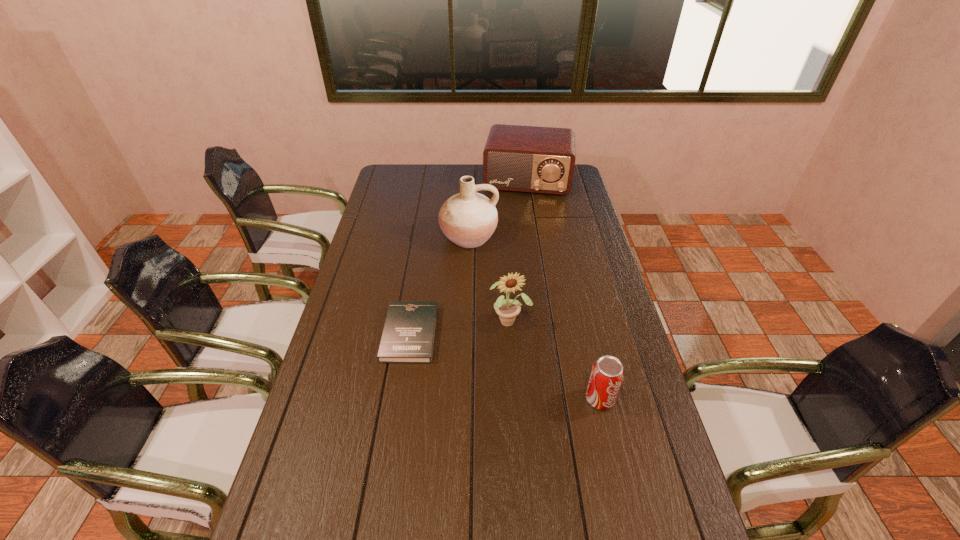
At what (x,y) coordinates should I click in order to perform the action: click on vacant area between the sunflower and the shortest object. Please return your answer as a coordinate pair (x, y). Looking at the image, I should click on (460, 327).

The width and height of the screenshot is (960, 540). What are the coordinates of `free space between the soda can and the radio receiver` in the screenshot? It's located at (564, 290).

Where is `free spot between the farthest object and the shortest object`? free spot between the farthest object and the shortest object is located at coordinates (468, 258).

Identify the location of vacant region between the sunflower and the fourth nearest object. (489, 279).

Select which object appears as the third closest to the second shortest object. Please provide its 2D coordinates. Your answer should be formatted as a tuple, i.e. [(x, y)], where the tuple contains the x and y coordinates of a point satisfying the conditions above.

[(468, 219)]

The height and width of the screenshot is (540, 960). I want to click on the third closest object to the book, so click(607, 374).

Find the location of `vacant point that satisfies the following two spatial constraints: 1. on the front side of the shortest object; 2. on the left side of the soda can`. vacant point that satisfies the following two spatial constraints: 1. on the front side of the shortest object; 2. on the left side of the soda can is located at coordinates (400, 399).

Where is `free location that satisfies the following two spatial constraints: 1. on the back side of the book; 2. on the right side of the second farthest object`? free location that satisfies the following two spatial constraints: 1. on the back side of the book; 2. on the right side of the second farthest object is located at coordinates (425, 237).

The height and width of the screenshot is (540, 960). Identify the location of vacant area that satisfies the following two spatial constraints: 1. on the front side of the radio receiver; 2. on the left side of the fourth tallest object. tap(563, 399).